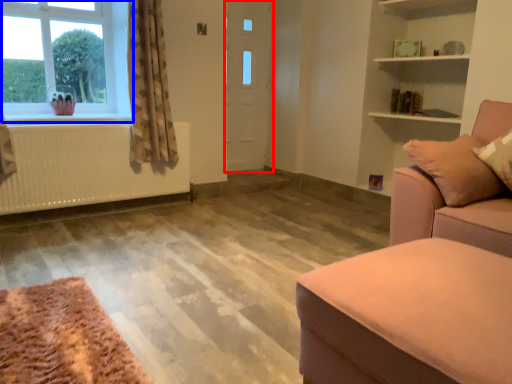
Question: Which object is further to the camera taking this photo, door (highlighted by a red box) or window (highlighted by a blue box)?

Choices:
 (A) door
 (B) window

Answer: (A)